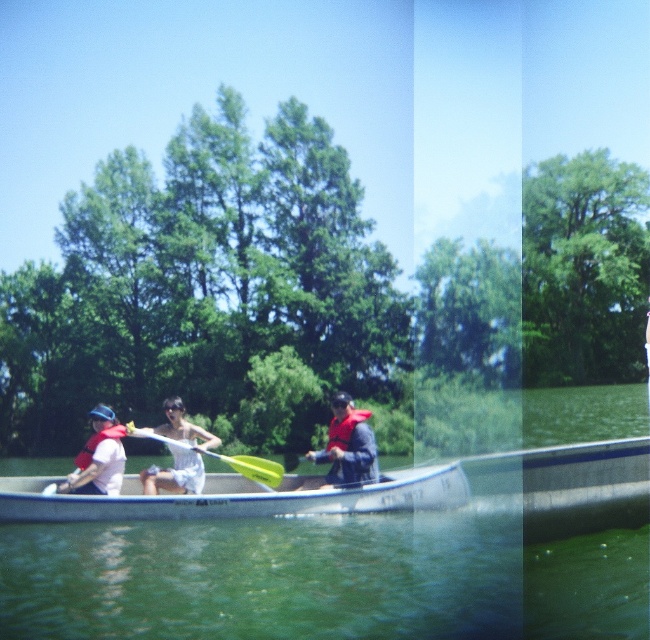
You are a photographer trying to capture a clear shot of both the yellow plastic paddle at center and the red matte life jacket at center. Since you want to focus on the paddle, which object should you adjust your camera focus on first?

The yellow plastic paddle at center is much taller than the red matte life jacket at center, so you should focus on the yellow plastic paddle at center first to ensure it is in clear view.

You are standing on the shore and looking at the canoe. There are two points marked on the canoe. The first point is at coordinate point (x=370, y=436) and the second point is at coordinate point (x=101, y=460). Which of these two points is closer to you?

Point (x=101, y=460) is closer to you because it is less further to the camera than point (x=370, y=436).